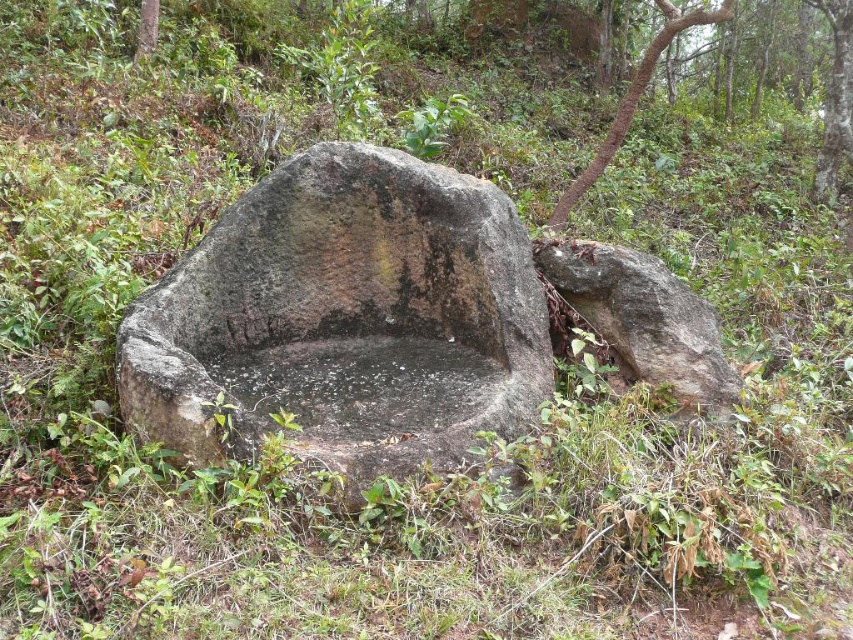
Question: Is gray rough stone at center closer to the viewer compared to brown rough bark tree at upper center?

Choices:
 (A) no
 (B) yes

Answer: (B)

Question: Which point is closer to the camera?

Choices:
 (A) brown rough bark tree at upper center
 (B) gray rough stone at center
 (C) gray rough boulder at right

Answer: (B)

Question: Is gray rough stone at center behind gray rough boulder at right?

Choices:
 (A) yes
 (B) no

Answer: (B)

Question: Which of these objects is positioned farthest from the brown rough bark tree at upper center?

Choices:
 (A) gray rough boulder at right
 (B) gray rough stone at center

Answer: (B)

Question: Is gray rough stone at center to the left of gray rough boulder at right from the viewer's perspective?

Choices:
 (A) yes
 (B) no

Answer: (A)

Question: Which of the following is the farthest from the observer?

Choices:
 (A) brown rough bark tree at upper center
 (B) gray rough boulder at right
 (C) gray rough stone at center

Answer: (A)